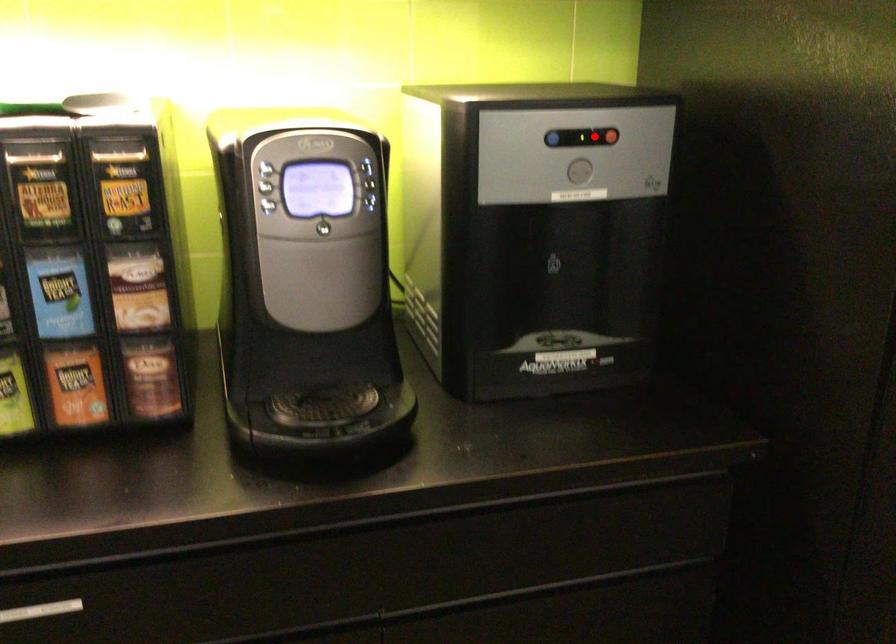
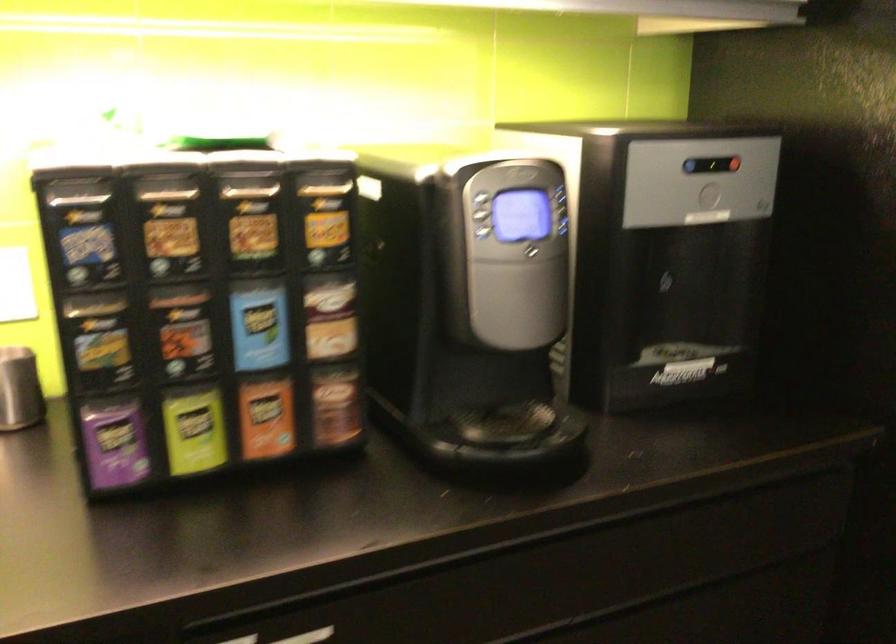
In the second image, find the point that corresponds to the highlighted location in the first image.

(724, 163)